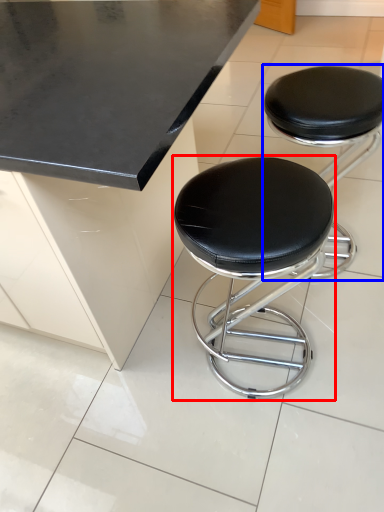
Question: Which object appears closest to the camera in this image, stool (highlighted by a red box) or stool (highlighted by a blue box)?

Choices:
 (A) stool
 (B) stool

Answer: (A)